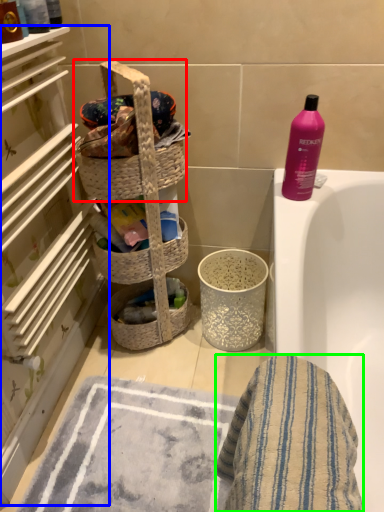
Question: Which object is the farthest from picnic basket (highlighted by a red box)? Choose among these: shelf (highlighted by a blue box) or bath towel (highlighted by a green box).

Choices:
 (A) shelf
 (B) bath towel

Answer: (B)